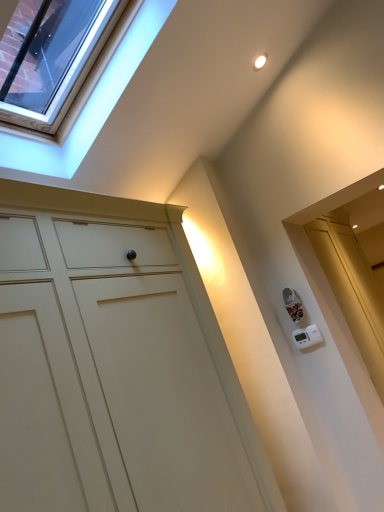
Where is `clear glass window at upper left`? clear glass window at upper left is located at coordinates (43, 49).

What do you see at coordinates (43, 49) in the screenshot? This screenshot has width=384, height=512. I see `clear glass window at upper left` at bounding box center [43, 49].

Describe the element at coordinates (115, 365) in the screenshot. I see `matte white cupboard at center` at that location.

The width and height of the screenshot is (384, 512). I want to click on matte white cupboard at center, so click(115, 365).

Where is `clear glass window at upper left`? This screenshot has height=512, width=384. clear glass window at upper left is located at coordinates (43, 49).

Between clear glass window at upper left and matte white cupboard at center, which one appears on the left side from the viewer's perspective?

From the viewer's perspective, clear glass window at upper left appears more on the left side.

Considering the positions of objects clear glass window at upper left and matte white cupboard at center in the image provided, who is in front, clear glass window at upper left or matte white cupboard at center?

matte white cupboard at center.

Which is behind, point (62, 19) or point (84, 234)?

The point (62, 19) is farther from the camera.

From the image's perspective, which is below, clear glass window at upper left or matte white cupboard at center?

matte white cupboard at center, from the image's perspective.

From a real-world perspective, is clear glass window at upper left over matte white cupboard at center?

Indeed, from a real-world perspective, clear glass window at upper left stands above matte white cupboard at center.

Does clear glass window at upper left have a greater width compared to matte white cupboard at center?

No.

From their relative heights in the image, would you say clear glass window at upper left is taller or shorter than matte white cupboard at center?

In the image, clear glass window at upper left appears to be shorter than matte white cupboard at center.

Between clear glass window at upper left and matte white cupboard at center, which one has smaller size?

clear glass window at upper left is smaller.

Choose the correct answer: Is clear glass window at upper left inside matte white cupboard at center or outside it?

clear glass window at upper left lies outside matte white cupboard at center.

Consider the image. Are clear glass window at upper left and matte white cupboard at center far apart?

Absolutely, clear glass window at upper left is distant from matte white cupboard at center.

Is clear glass window at upper left facing towards matte white cupboard at center?

No, clear glass window at upper left is not facing towards matte white cupboard at center.

What's the angular difference between clear glass window at upper left and matte white cupboard at center's facing directions?

1.23 degrees separate the facing orientations of clear glass window at upper left and matte white cupboard at center.

Identify the location of cupboard in front of the clear glass window at upper left. (115, 365).

Which is more to the left, matte white cupboard at center or clear glass window at upper left?

From the viewer's perspective, clear glass window at upper left appears more on the left side.

Is the depth of matte white cupboard at center greater than that of clear glass window at upper left?

No, it is not.

Is point (234, 410) positioned behind point (33, 69)?

No, (234, 410) is in front of (33, 69).

From the image's perspective, which object appears higher, matte white cupboard at center or clear glass window at upper left?

clear glass window at upper left.

From a real-world perspective, who is located higher, matte white cupboard at center or clear glass window at upper left?

clear glass window at upper left is physically above.

Looking at their sizes, would you say matte white cupboard at center is wider or thinner than clear glass window at upper left?

Considering their sizes, matte white cupboard at center looks broader than clear glass window at upper left.

Is matte white cupboard at center shorter than clear glass window at upper left?

Incorrect, the height of matte white cupboard at center does not fall short of that of clear glass window at upper left.

Which of these two, matte white cupboard at center or clear glass window at upper left, is smaller?

With smaller size is clear glass window at upper left.

Is matte white cupboard at center completely or partially outside of clear glass window at upper left?

Yes, matte white cupboard at center is located beyond the bounds of clear glass window at upper left.

Are matte white cupboard at center and clear glass window at upper left located far from each other?

matte white cupboard at center is positioned a significant distance from clear glass window at upper left.

Could you tell me if matte white cupboard at center is turned towards clear glass window at upper left?

No, matte white cupboard at center is not turned towards clear glass window at upper left.

How different are the orientations of matte white cupboard at center and clear glass window at upper left in degrees?

The facing directions of matte white cupboard at center and clear glass window at upper left are 1.23 degrees apart.

You are a GUI agent. You are given a task and a screenshot of the screen. Output one action in this format:
    pyautogui.click(x=<x>, y=<y>)
    Task: Click on the cupboard in front of the clear glass window at upper left
    
    Given the screenshot: What is the action you would take?
    pyautogui.click(x=115, y=365)

Identify the location of glass door above the matte white cupboard at center (from the image's perspective). (43, 49).

The width and height of the screenshot is (384, 512). Identify the location of glass door above the matte white cupboard at center (from a real-world perspective). (43, 49).